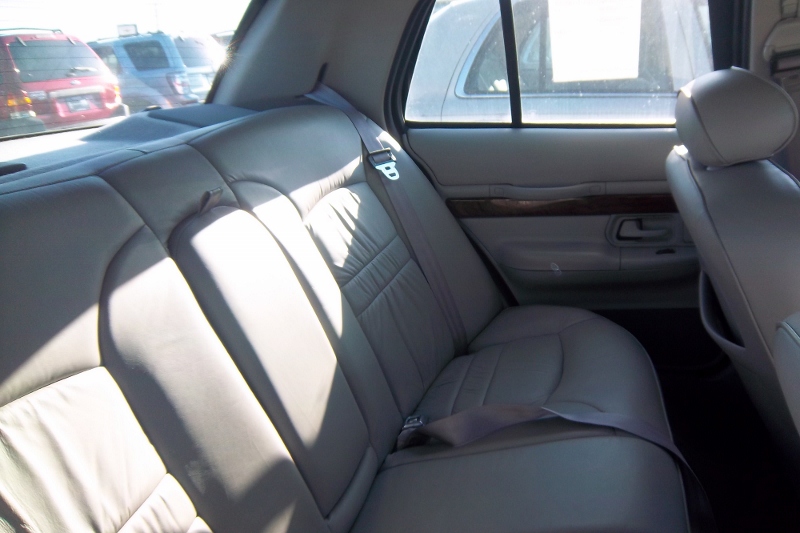
Find the location of a particular element. This screenshot has width=800, height=533. seat is located at coordinates (722, 222), (304, 155), (245, 287), (62, 282).